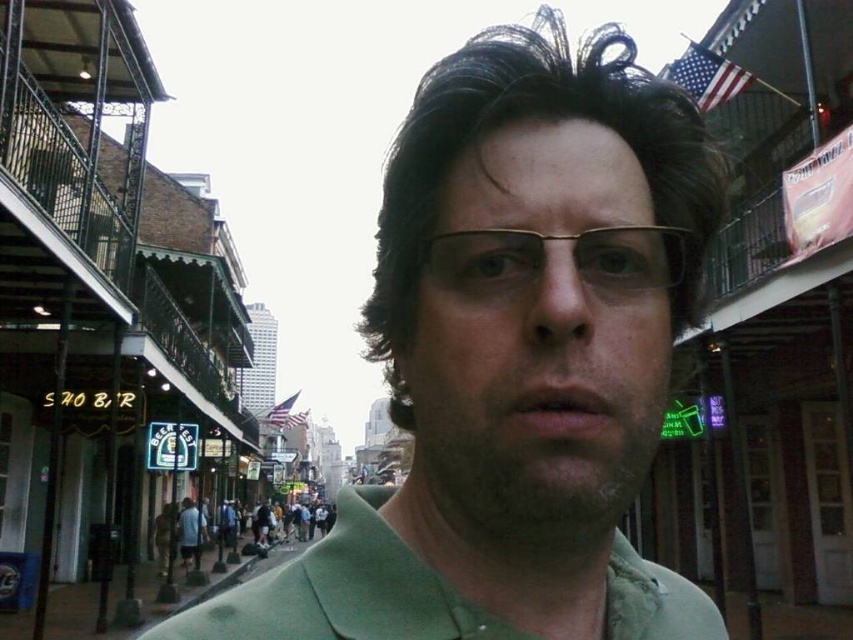
You are a photographer standing at the edge of the street. You want to take a photo that includes both the green matte shirt at center and the blue fabric shirt at lower center. Given that your camera has a maximum zoom range of 10 meters, will you be able to capture both subjects in the same frame without moving closer?

The green matte shirt at center and blue fabric shirt at lower center are 18.66 meters apart from each other. Since the camera can only zoom up to 10 meters, you will not be able to capture both subjects in the same frame without moving closer.

You are a photographer trying to capture the person in the image. Which object, the dark brown textured hair at center or the blue fabric shirt at lower center, is located higher up on the person?

The dark brown textured hair at center is positioned over the blue fabric shirt at lower center, so it is higher up on the person.